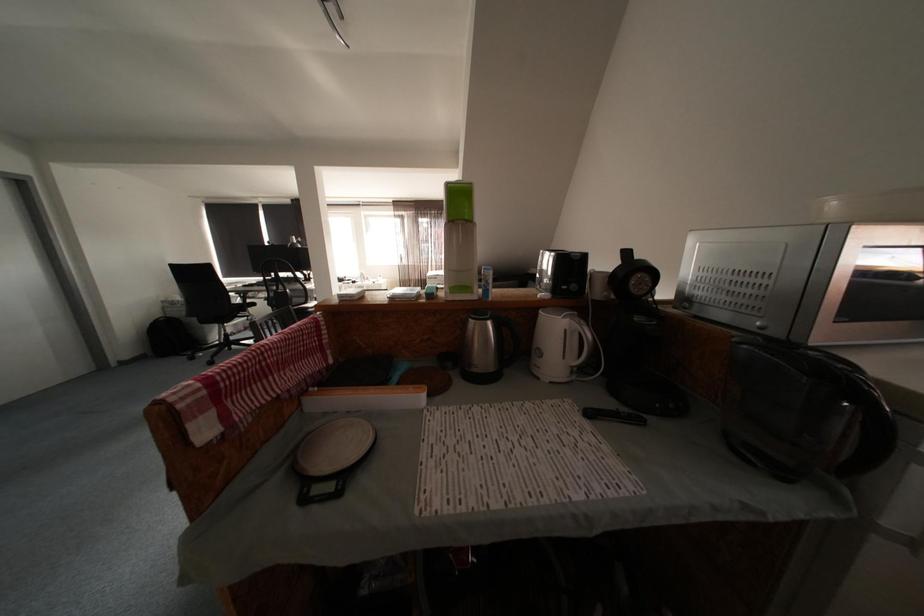
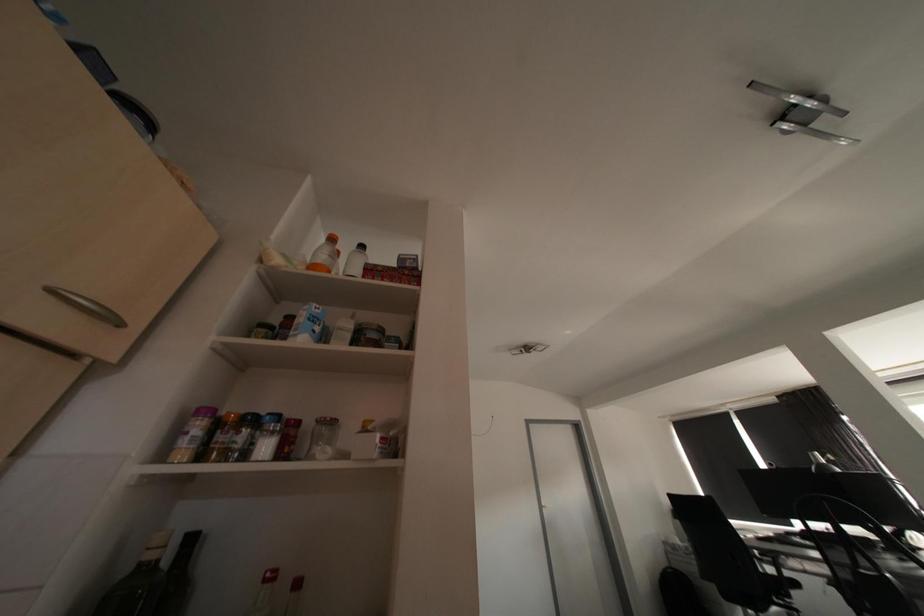
First-person continuous shooting, in which direction is the camera rotating?

The camera's rotation is toward left-up.